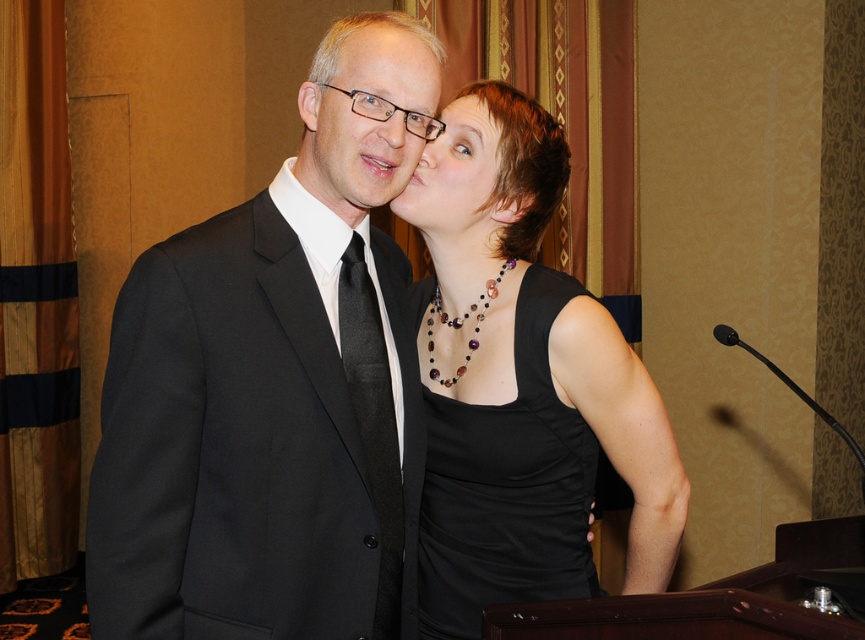
Based on the photo, between black matte suit at center and matte black dress at center, which one appears on the right side from the viewer's perspective?

matte black dress at center is more to the right.

Can you confirm if black matte suit at center is taller than matte black dress at center?

Correct, black matte suit at center is much taller as matte black dress at center.

Is point (223, 419) positioned after point (469, 104)?

No, it is in front of (469, 104).

This screenshot has height=640, width=865. In order to click on black matte suit at center in this screenshot , I will do `click(274, 385)`.

Which is more to the right, black textured tie at left or matte black dress at center?

matte black dress at center is more to the right.

Is black textured tie at left further to the viewer compared to matte black dress at center?

No, it is in front of matte black dress at center.

The height and width of the screenshot is (640, 865). What do you see at coordinates (373, 424) in the screenshot? I see `black textured tie at left` at bounding box center [373, 424].

You are a GUI agent. You are given a task and a screenshot of the screen. Output one action in this format:
    pyautogui.click(x=<x>, y=<y>)
    Task: Click on the black textured tie at left
    This screenshot has height=640, width=865.
    Given the screenshot: What is the action you would take?
    pyautogui.click(x=373, y=424)

Who is positioned more to the left, black matte suit at center or matte black suit at center?

From the viewer's perspective, black matte suit at center appears more on the left side.

Is black matte suit at center below matte black suit at center?

Yes, black matte suit at center is below matte black suit at center.

Between point (363, 276) and point (413, 109), which one is positioned in front?

Point (413, 109)

This screenshot has width=865, height=640. In order to click on black matte suit at center in this screenshot , I will do `click(274, 385)`.